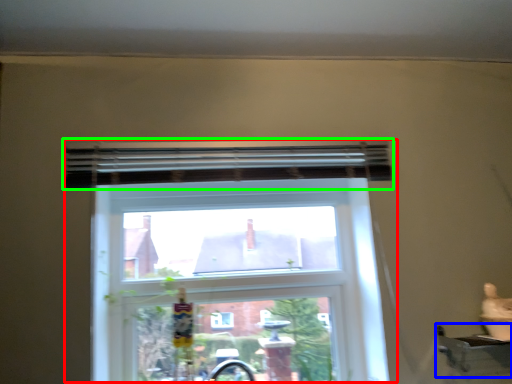
Question: Based on their relative distances, which object is farther from window (highlighted by a red box)? Choose from window sill (highlighted by a blue box) and curtain (highlighted by a green box).

Choices:
 (A) window sill
 (B) curtain

Answer: (A)